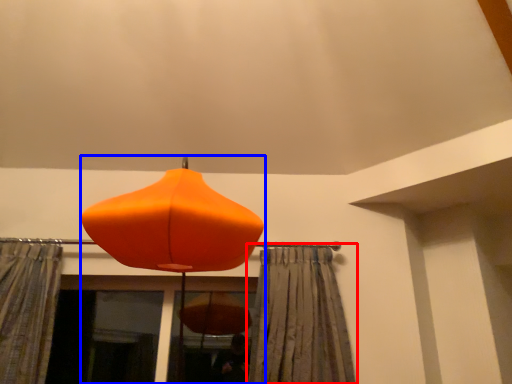
Question: Which object appears farthest to the camera in this image, curtain (highlighted by a red box) or lamp (highlighted by a blue box)?

Choices:
 (A) curtain
 (B) lamp

Answer: (A)